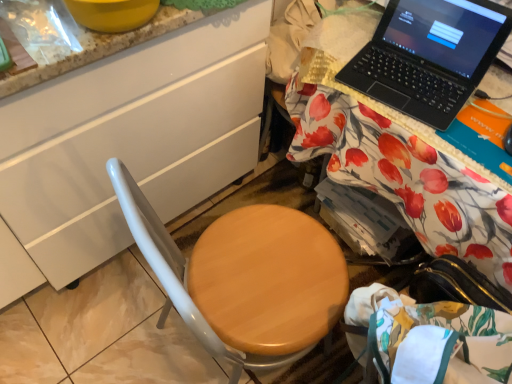
Question: Can you confirm if black plastic laptop at upper right is shorter than white glossy cabinet at left?

Choices:
 (A) no
 (B) yes

Answer: (B)

Question: Can you confirm if black plastic laptop at upper right is bigger than white glossy cabinet at left?

Choices:
 (A) no
 (B) yes

Answer: (A)

Question: Is the depth of black plastic laptop at upper right greater than that of white glossy cabinet at left?

Choices:
 (A) no
 (B) yes

Answer: (B)

Question: From the image's perspective, would you say black plastic laptop at upper right is shown under white glossy cabinet at left?

Choices:
 (A) yes
 (B) no

Answer: (B)

Question: Is black plastic laptop at upper right positioned far away from white glossy cabinet at left?

Choices:
 (A) no
 (B) yes

Answer: (A)

Question: From the image's perspective, is black plastic laptop at upper right on top of white glossy cabinet at left?

Choices:
 (A) no
 (B) yes

Answer: (B)

Question: Considering the relative sizes of black plastic laptop at upper right and wooden at right in the image provided, is black plastic laptop at upper right shorter than wooden at right?

Choices:
 (A) no
 (B) yes

Answer: (B)

Question: Would you say black plastic laptop at upper right is a long distance from wooden at right?

Choices:
 (A) no
 (B) yes

Answer: (A)

Question: Is black plastic laptop at upper right oriented towards wooden at right?

Choices:
 (A) no
 (B) yes

Answer: (A)

Question: From a real-world perspective, is black plastic laptop at upper right physically above wooden at right?

Choices:
 (A) no
 (B) yes

Answer: (B)

Question: Is black plastic laptop at upper right positioned beyond the bounds of wooden at right?

Choices:
 (A) yes
 (B) no

Answer: (A)

Question: Can wooden at right be found inside black plastic laptop at upper right?

Choices:
 (A) yes
 (B) no

Answer: (B)

Question: Is wooden at right at the left side of black plastic laptop at upper right?

Choices:
 (A) yes
 (B) no

Answer: (B)